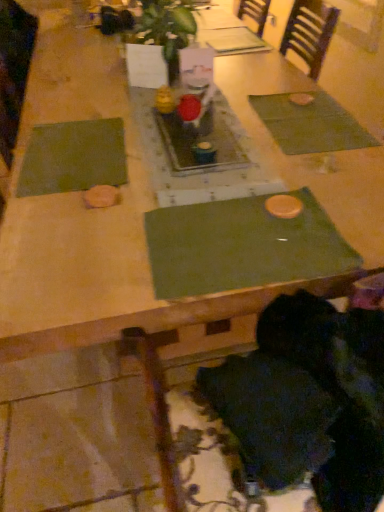
This screenshot has width=384, height=512. I want to click on vacant region to the right of green fabric place mat at center, which appears as the second place mat when viewed from the left, so click(x=352, y=206).